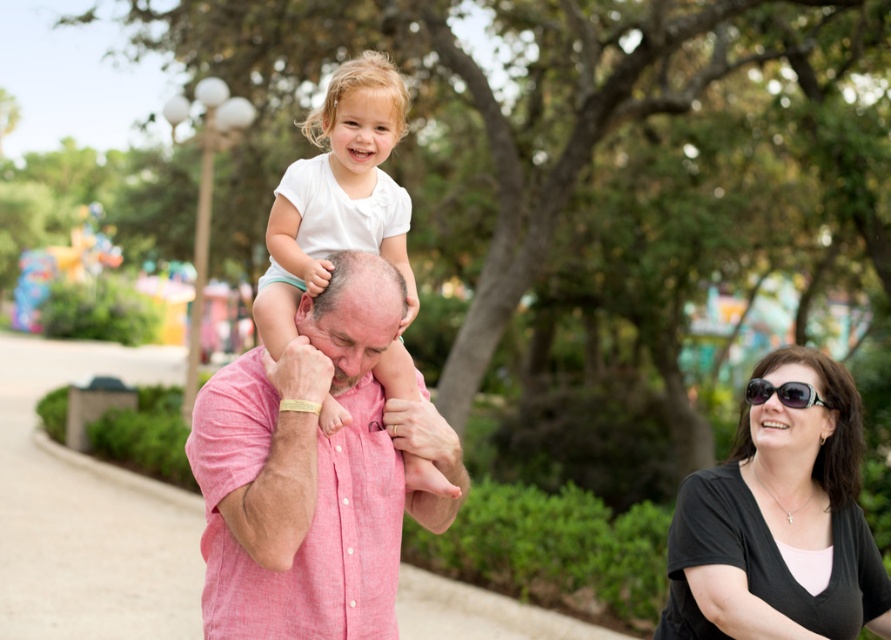
Question: Does black matte shirt at lower right come behind black plastic sunglasses at lower right?

Choices:
 (A) no
 (B) yes

Answer: (A)

Question: Which of the following is the closest to the observer?

Choices:
 (A) black matte shirt at lower right
 (B) white cotton shirt at center
 (C) black plastic sunglasses at lower right
 (D) pink linen shirt at center

Answer: (D)

Question: Is white cotton shirt at center above black plastic sunglasses at lower right?

Choices:
 (A) yes
 (B) no

Answer: (A)

Question: Is black matte shirt at lower right further to the viewer compared to black plastic sunglasses at lower right?

Choices:
 (A) yes
 (B) no

Answer: (B)

Question: Among these objects, which one is farthest from the camera?

Choices:
 (A) pink linen shirt at center
 (B) white cotton shirt at center
 (C) black matte shirt at lower right
 (D) black plastic sunglasses at lower right

Answer: (D)

Question: Which of the following is the closest to the observer?

Choices:
 (A) pink linen shirt at center
 (B) white cotton shirt at center

Answer: (A)